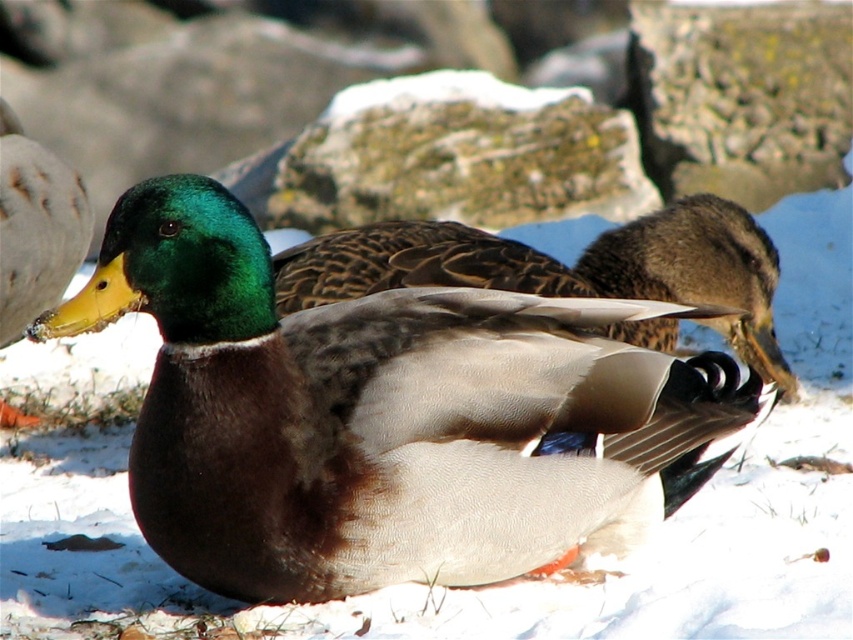
Question: Which object is farther from the camera taking this photo?

Choices:
 (A) shiny brown duck at center
 (B) brown textured duck at center

Answer: (B)

Question: Does shiny brown duck at center appear on the left side of brown textured duck at center?

Choices:
 (A) no
 (B) yes

Answer: (B)

Question: Can you confirm if shiny brown duck at center is bigger than brown textured duck at center?

Choices:
 (A) yes
 (B) no

Answer: (B)

Question: Is shiny brown duck at center closer to camera compared to brown textured duck at center?

Choices:
 (A) no
 (B) yes

Answer: (B)

Question: Which point is farther from the camera taking this photo?

Choices:
 (A) (630, 410)
 (B) (367, 282)

Answer: (B)